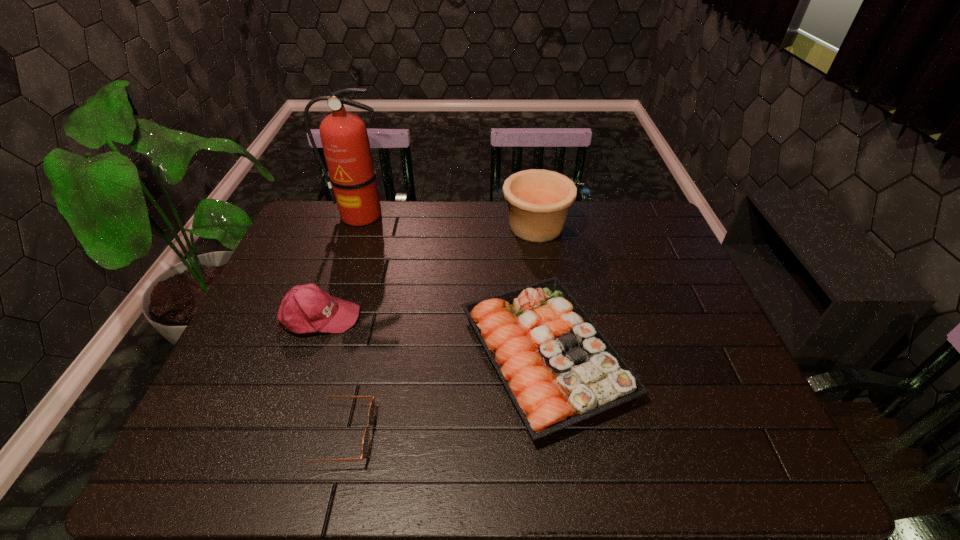
What are the coordinates of `vacant region between the platter and the baseball cap` in the screenshot? It's located at (433, 335).

Locate an element on the screen. This screenshot has height=540, width=960. free spot between the platter and the fire extinguisher is located at coordinates (453, 285).

Point out which object is positioned as the third nearest to the fire extinguisher. Please provide its 2D coordinates. Your answer should be formatted as a tuple, i.e. [(x, y)], where the tuple contains the x and y coordinates of a point satisfying the conditions above.

[(538, 200)]

Point out which object is positioned as the second nearest to the platter. Please provide its 2D coordinates. Your answer should be formatted as a tuple, i.e. [(x, y)], where the tuple contains the x and y coordinates of a point satisfying the conditions above.

[(371, 412)]

In order to click on vacant region that satisfies the following two spatial constraints: 1. on the side of the platter with the nozzle and handle; 2. on the right side of the tallest object in this screenshot , I will do `click(313, 354)`.

This screenshot has width=960, height=540. Identify the location of vacant point that satisfies the following two spatial constraints: 1. on the front side of the fourth shortest object; 2. on the front-facing side of the sunglasses. (568, 435).

The width and height of the screenshot is (960, 540). In order to click on blank space that satisfies the following two spatial constraints: 1. at the front of the platter with the brim; 2. on the right side of the third tallest object in this screenshot , I will do `click(306, 354)`.

This screenshot has width=960, height=540. What are the coordinates of `free space that satisfies the following two spatial constraints: 1. on the side of the pottery with the nozzle and handle; 2. on the left side of the fire extinguisher` in the screenshot? It's located at (356, 226).